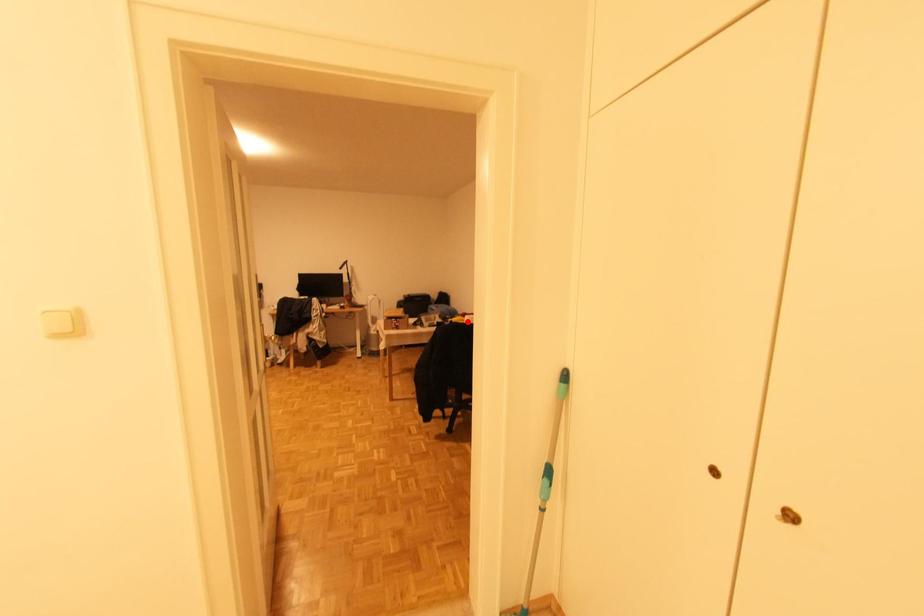
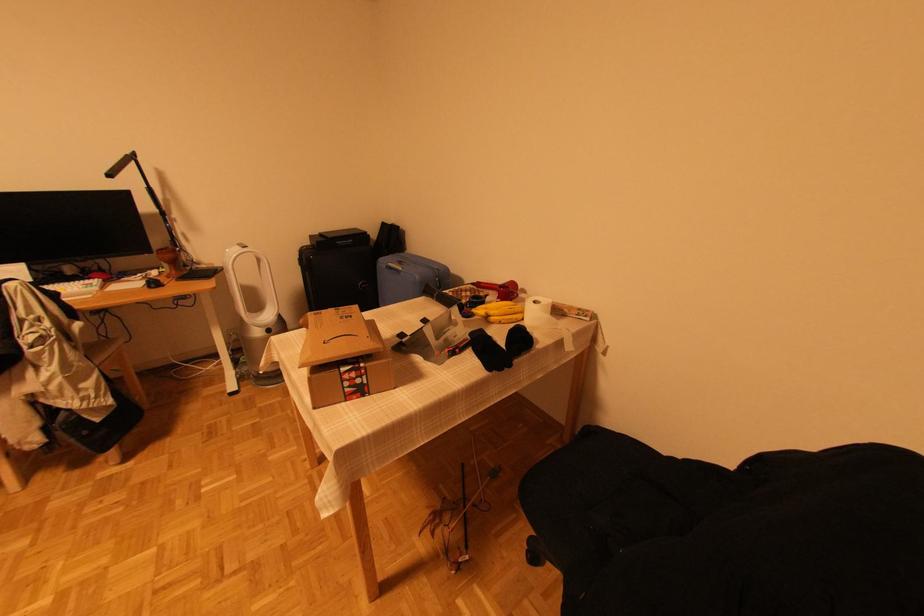
In the second image, find the point that corresponds to the highlighted location in the first image.

(525, 313)